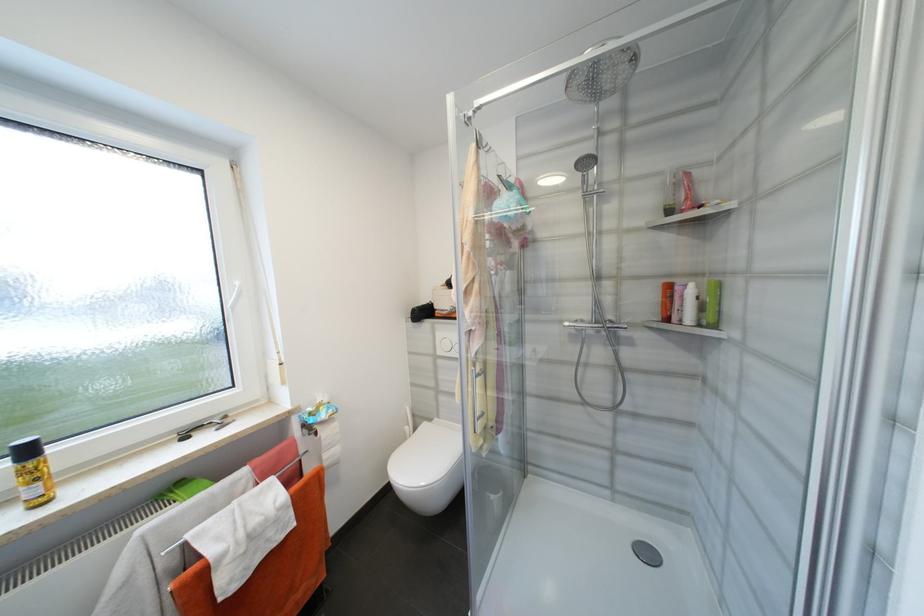
Find where to pull the metal shower handle. Please return your answer as a coordinate pair (x, y).

(590, 187)